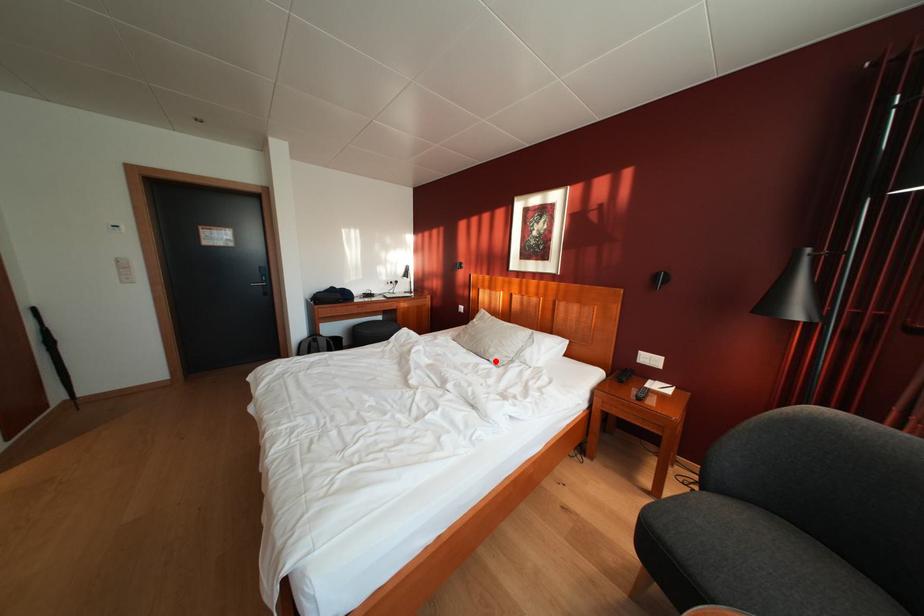
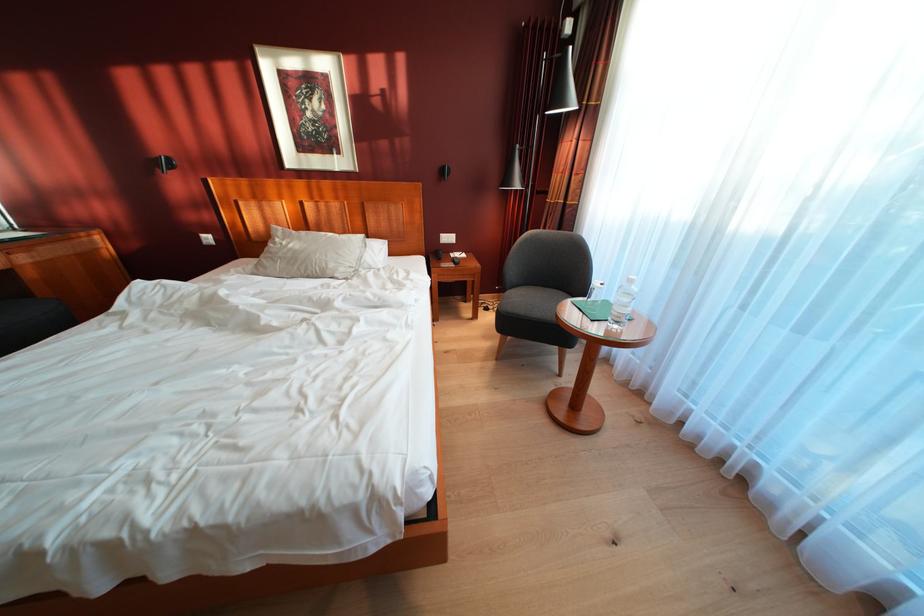
Find the pixel in the second image that matches the highlighted location in the first image.

(336, 278)